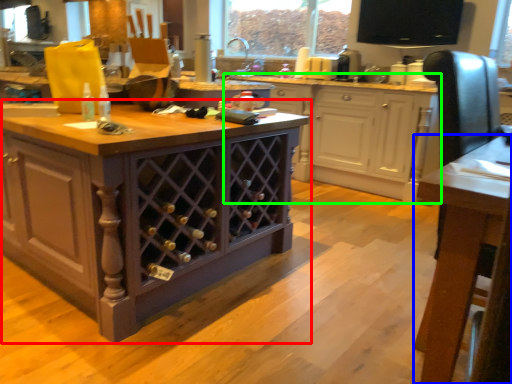
Question: Which object is positioned closest to cabinetry (highlighted by a red box)? Select from table (highlighted by a blue box) and cabinetry (highlighted by a green box).

Choices:
 (A) table
 (B) cabinetry

Answer: (A)